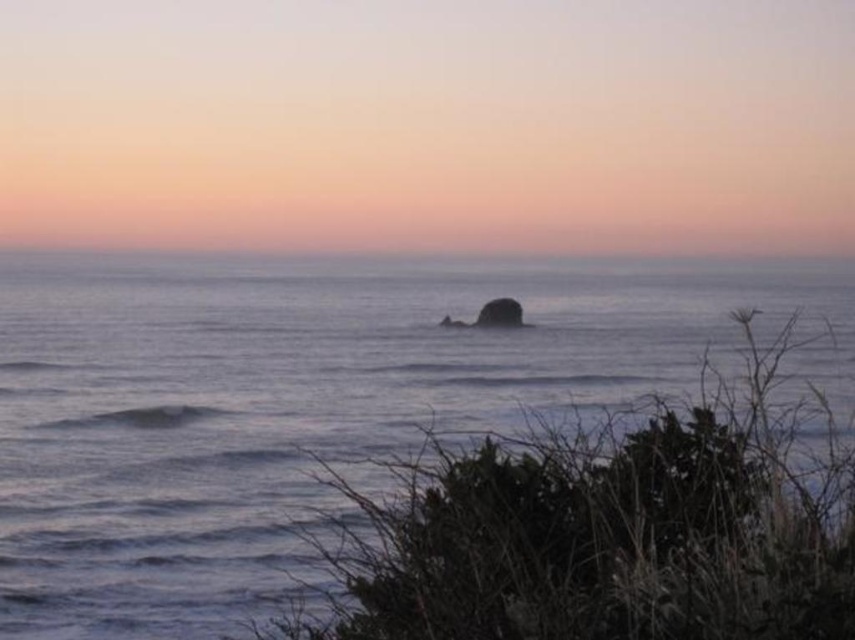
You are standing at the point marked as point (310,401) in the coastal scene. What do you see directly in front of you?

At point (310,401) lies smooth blue water at center, so you would see smooth blue water at center directly in front of you.

You are standing on the beach looking at the scene. Which object, the smooth blue water at center or the smooth gray rock at center, is nearer to you?

The smooth blue water at center is closer to the viewer than the smooth gray rock at center.